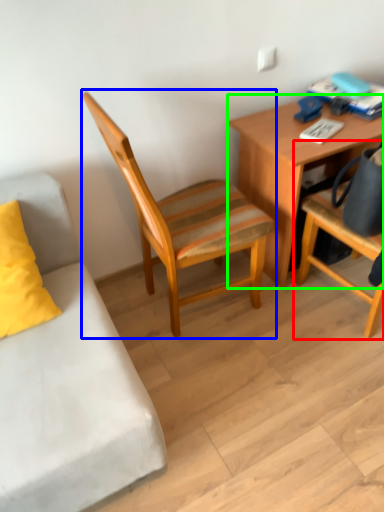
Question: Considering the real-world distances, which object is farthest from chair (highlighted by a red box)? chair (highlighted by a blue box) or desk (highlighted by a green box)?

Choices:
 (A) chair
 (B) desk

Answer: (A)